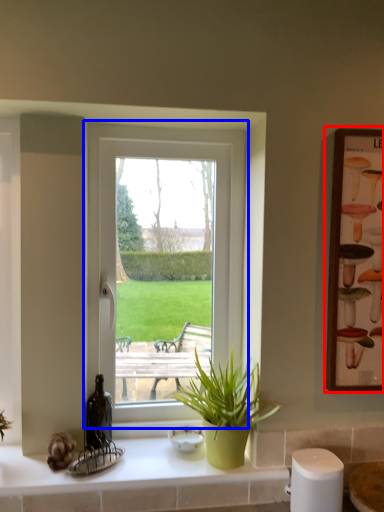
Question: Which point is further to the camera, picture frame (highlighted by a red box) or window (highlighted by a blue box)?

Choices:
 (A) picture frame
 (B) window

Answer: (B)